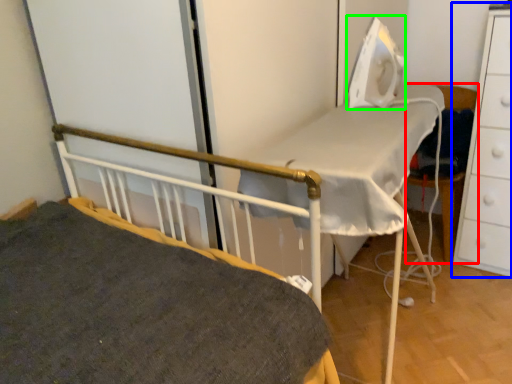
Question: Which object is the farthest from chair (highlighted by a red box)? Choose among these: chest of drawers (highlighted by a blue box) or equipment (highlighted by a green box).

Choices:
 (A) chest of drawers
 (B) equipment

Answer: (B)